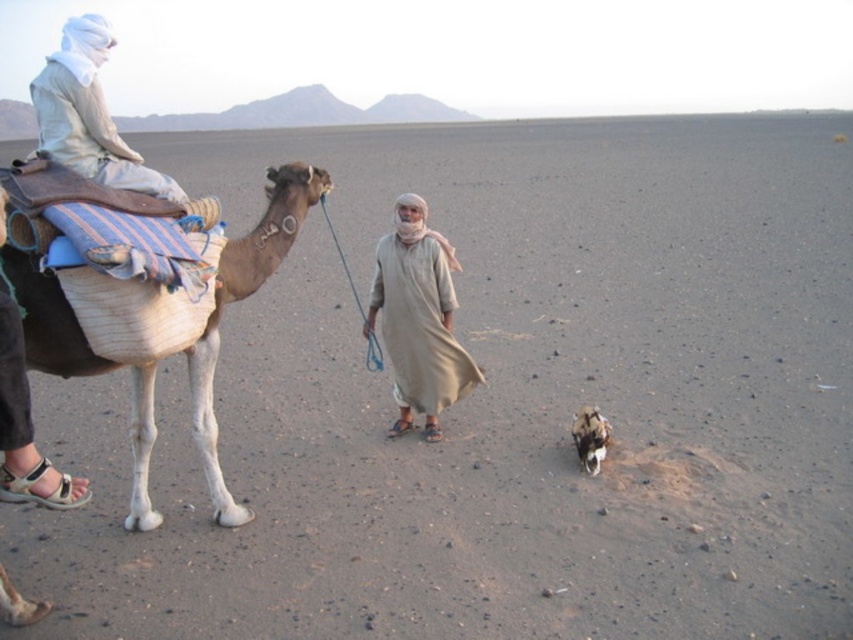
Can you confirm if brown leather sandal at lower center is positioned below brown leather sandal at center?

Actually, brown leather sandal at lower center is above brown leather sandal at center.

Does brown leather sandal at lower center have a smaller size compared to brown leather sandal at center?

No.

Is point (410, 429) more distant than point (428, 428)?

Yes, point (410, 429) is farther from viewer.

Where is `brown leather sandal at lower center`? This screenshot has height=640, width=853. brown leather sandal at lower center is located at coordinates (399, 426).

Which is more to the left, white cotton headscarf at upper left or brown leather sandal at lower center?

Positioned to the left is white cotton headscarf at upper left.

Is point (32, 93) less distant than point (395, 429)?

Yes, point (32, 93) is in front of point (395, 429).

Identify the location of white cotton headscarf at upper left. This screenshot has height=640, width=853. (88, 113).

Is point (408, 412) positioned before point (405, 433)?

No, (408, 412) is further to viewer.

Locate an element on the screen. Image resolution: width=853 pixels, height=640 pixels. beige cotton robe at center is located at coordinates pyautogui.click(x=418, y=314).